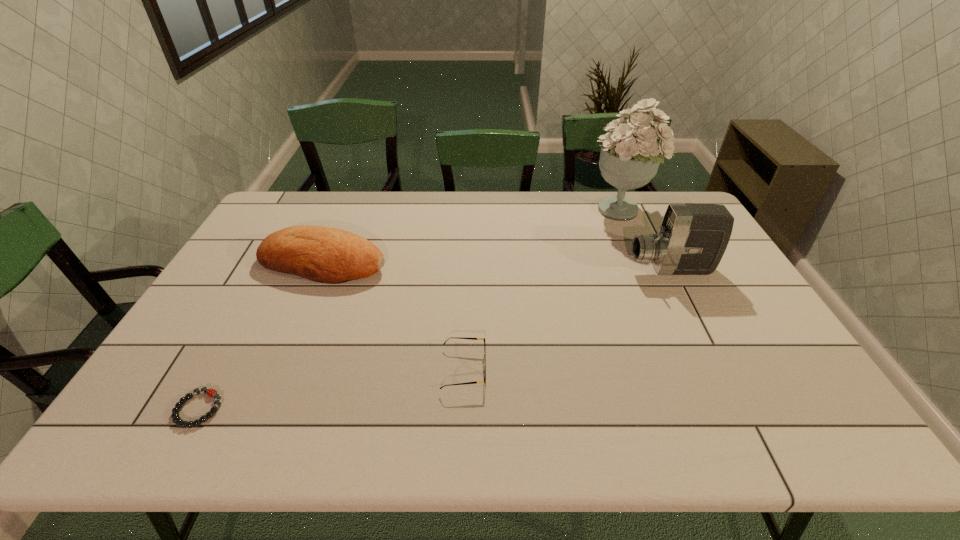
Identify the location of vacant area that lies between the bouquet and the third tallest object. The image size is (960, 540). (472, 236).

At what (x,y) coordinates should I click in order to perform the action: click on blank region between the camcorder and the second shortest object. Please return your answer as a coordinate pair (x, y). The image size is (960, 540). Looking at the image, I should click on (567, 320).

Locate an element on the screen. free space that is in between the bread and the third object from left to right is located at coordinates (394, 316).

Image resolution: width=960 pixels, height=540 pixels. What are the coordinates of `vacant region between the shortest object and the second tallest object` in the screenshot? It's located at pyautogui.click(x=435, y=339).

Locate an element on the screen. free space between the bread and the camcorder is located at coordinates (497, 266).

The height and width of the screenshot is (540, 960). I want to click on unoccupied area between the farthest object and the bracelet, so click(x=410, y=309).

Locate an element on the screen. This screenshot has width=960, height=540. free space between the third tallest object and the bracelet is located at coordinates (261, 336).

I want to click on free spot between the spectacles and the third shortest object, so click(394, 316).

Where is `vacant area that lies between the camcorder and the bread`? The width and height of the screenshot is (960, 540). vacant area that lies between the camcorder and the bread is located at coordinates (497, 266).

Where is `object that is the second closest to the shortest object`? object that is the second closest to the shortest object is located at coordinates (476, 382).